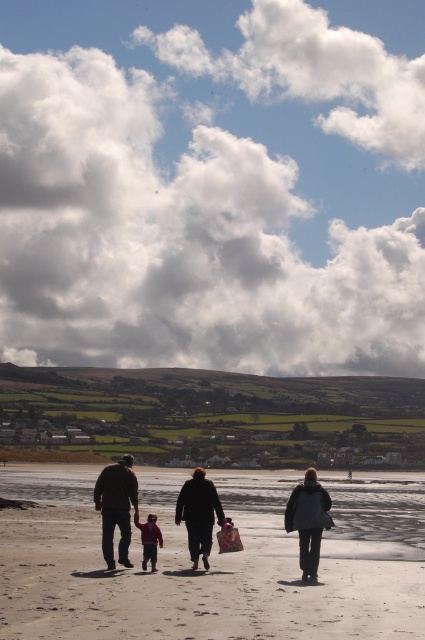
In the scene shown: You are a photographer setting up a tripod to capture the beach scene. You need to place the tripod so that it doesn not block the view of the brown leather jacket at lower left and the matte red sweater at center. Given that the tripod requires 1 meter of space around it, can you position it between these two objects?

The brown leather jacket at lower left is wider than the matte red sweater at center. However, the distance between them isn not specified in the description. Without knowing the actual distance between the two objects, it is impossible to determine if the tripod can be placed between them with 1 meter of space around it.

You are a photographer trying to capture a photo of the dark gray coat at center and the matte red sweater at center. Since you want both subjects to appear the same size in the photo, which direction should you move your camera? Explain your reasoning.

The dark gray coat at center is wider than the matte red sweater at center. To make them appear the same size in the photo, you should move the camera closer to the matte red sweater at center and farther from the dark gray coat at center. This adjustment balances their apparent sizes based on their actual widths.

You are a photographer standing on the beach and want to capture a photo of the dark gray coat at center without the light brown sand at center showing in the foreground. Is this possible based on their positions?

The light brown sand at center is positioned under the dark gray coat at center, so the sand is beneath the coat and not in the foreground. Therefore, it is possible to capture the dark gray coat at center without the light brown sand at center appearing in the foreground.